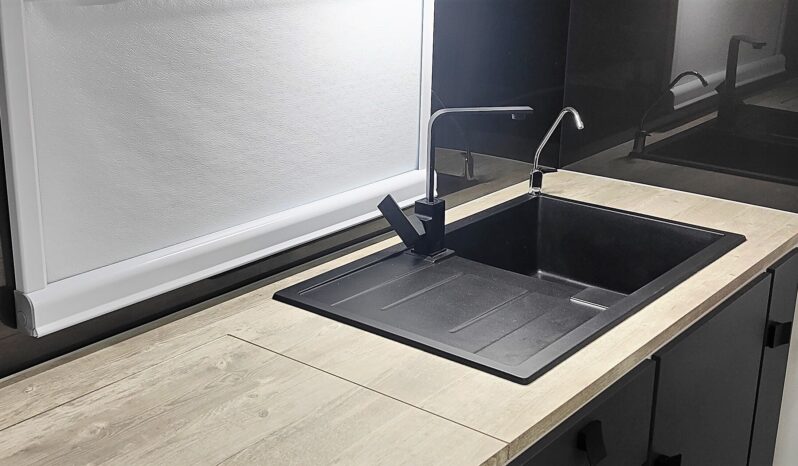
The height and width of the screenshot is (466, 798). Identify the location of black backsplash behind sink. (495, 53).